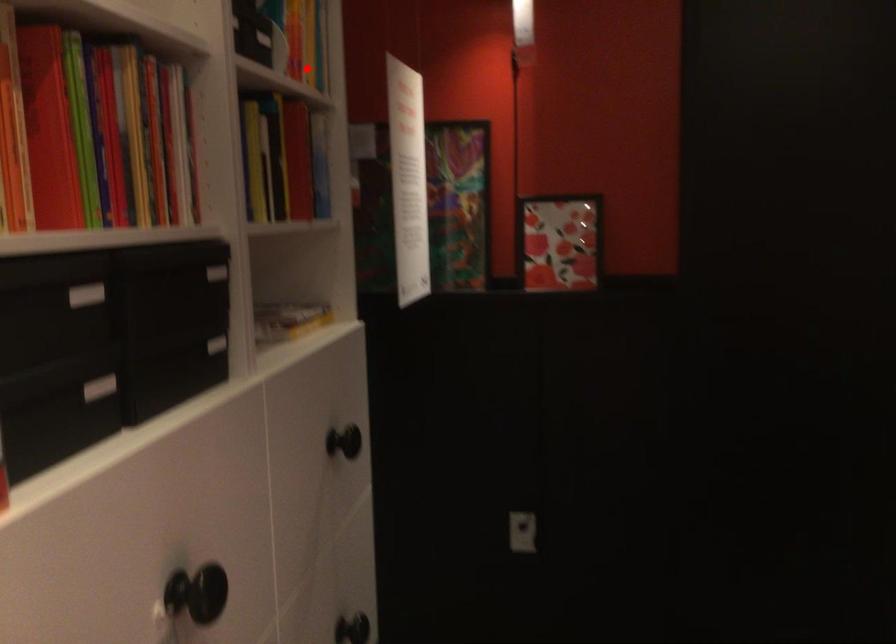
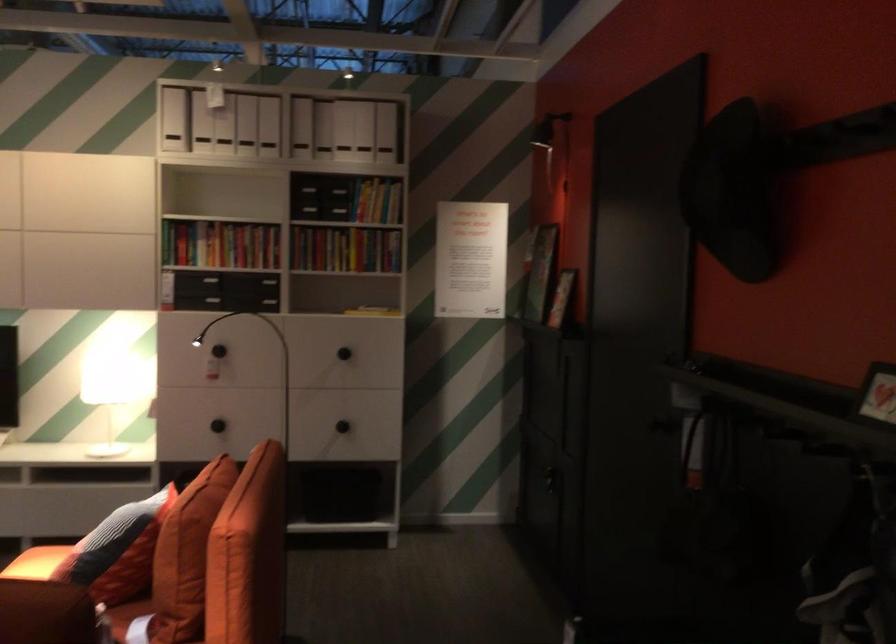
Locate, in the second image, the point that corresponds to the highlighted location in the first image.

(376, 201)